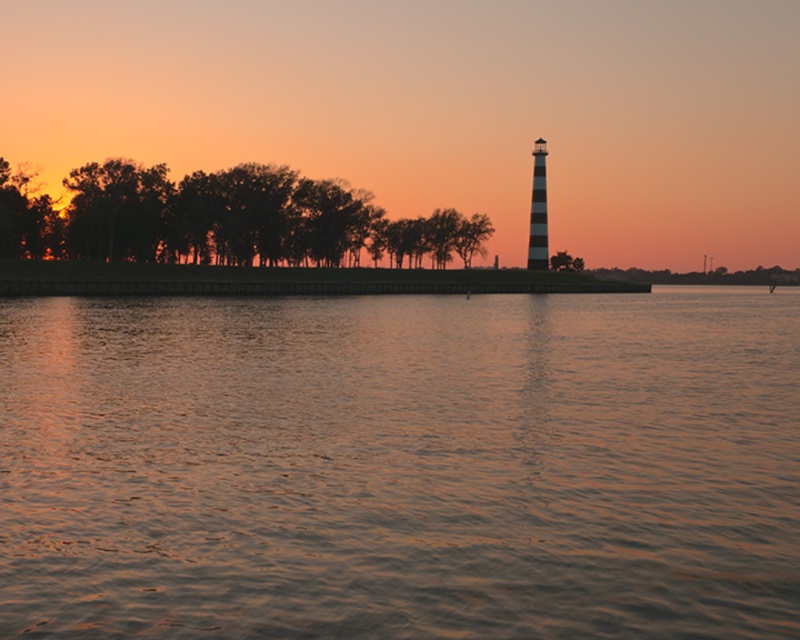
Is smooth water at center wider than silhouette wood trees at left?

Correct, the width of smooth water at center exceeds that of silhouette wood trees at left.

Between smooth water at center and silhouette wood trees at left, which one is positioned higher?

silhouette wood trees at left is above.

Which is behind, point (698, 604) or point (70, 204)?

The point (70, 204) is behind.

What are the coordinates of `smooth water at center` in the screenshot? It's located at (400, 465).